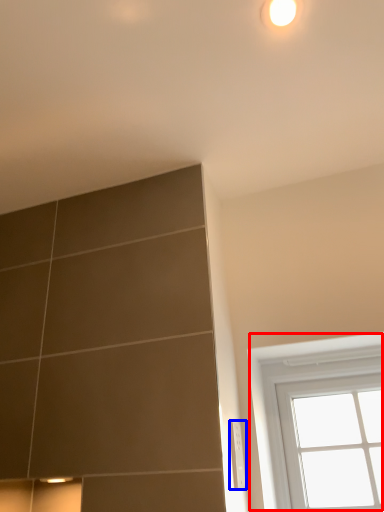
Question: Which object appears closest to the camera in this image, window (highlighted by a red box) or electric outlet (highlighted by a blue box)?

Choices:
 (A) window
 (B) electric outlet

Answer: (B)